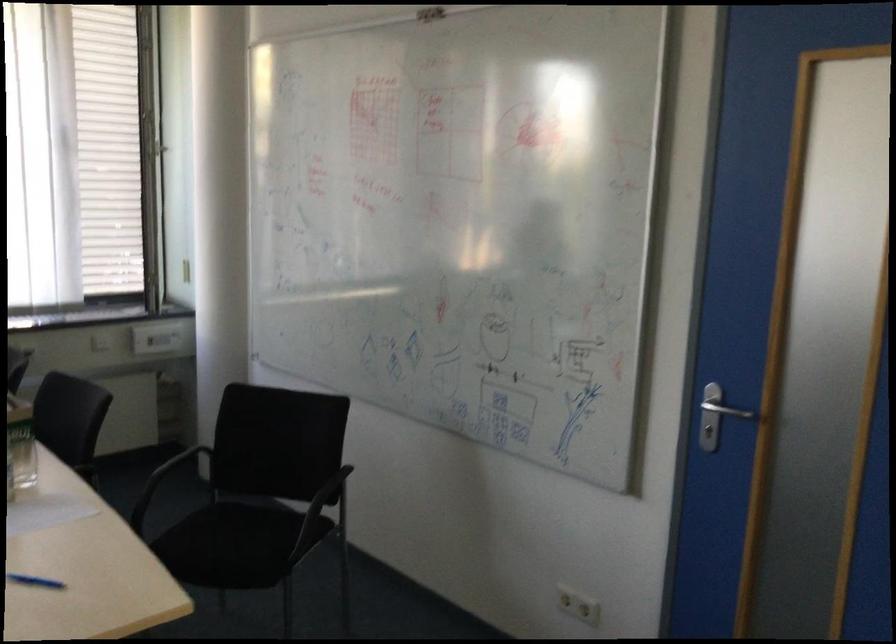
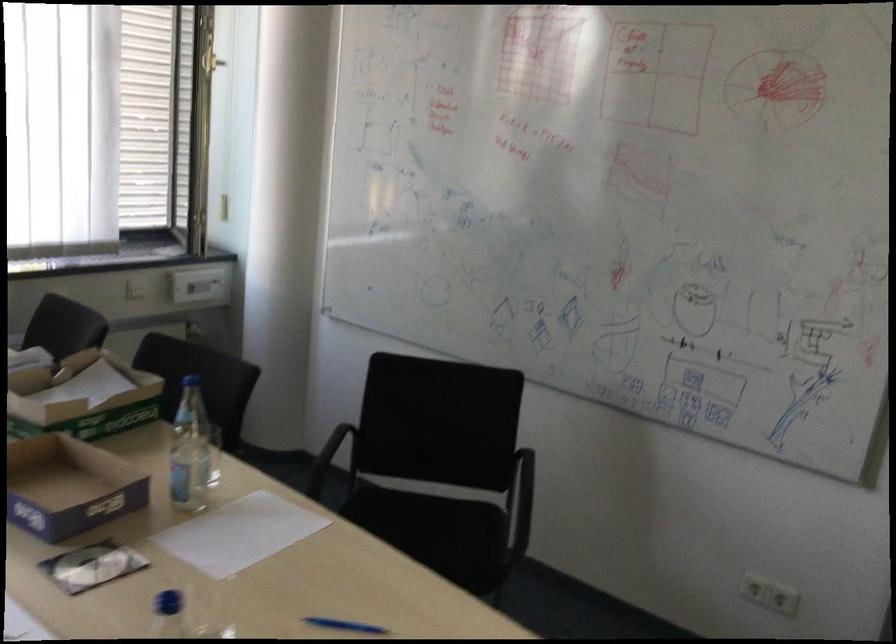
Which direction would the cameraman need to move to produce the second image?

The movement direction of the cameraman is left, forward.